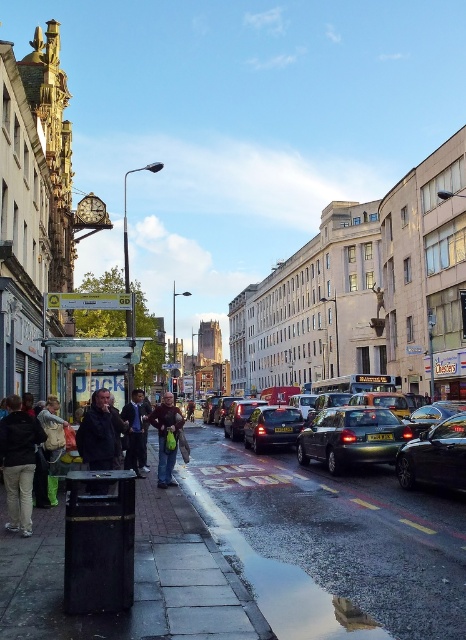
You are standing at the bus stop shelter with the sign displaying Jack. You want to walk to the shiny metallic car at center. In which direction should you walk relative to the bus stop?

The shiny metallic car at center is located at coordinates point (351, 436). Since you are at the bus stop shelter with the sign displaying Jack on the left side of the image, you should walk towards the center of the scene to reach the shiny metallic car at center.

You are standing at the bus stop shelter with the sign displaying Jack and want to cross the street to the shiny black sedan at center. What direction should you walk to reach it?

The shiny black sedan at center is located at point coordinates of [272,428]. Since you are at the bus stop shelter, you should walk towards the center of the street to reach the shiny black sedan at center.

Consider the image. You are a pedestrian standing at the bus stop shelter with the Jack sign. You notice a shiny metallic car at center and a dark gray jacket at center. Which object is bigger in size?

The shiny metallic car at center is larger in size compared to the dark gray jacket at center.